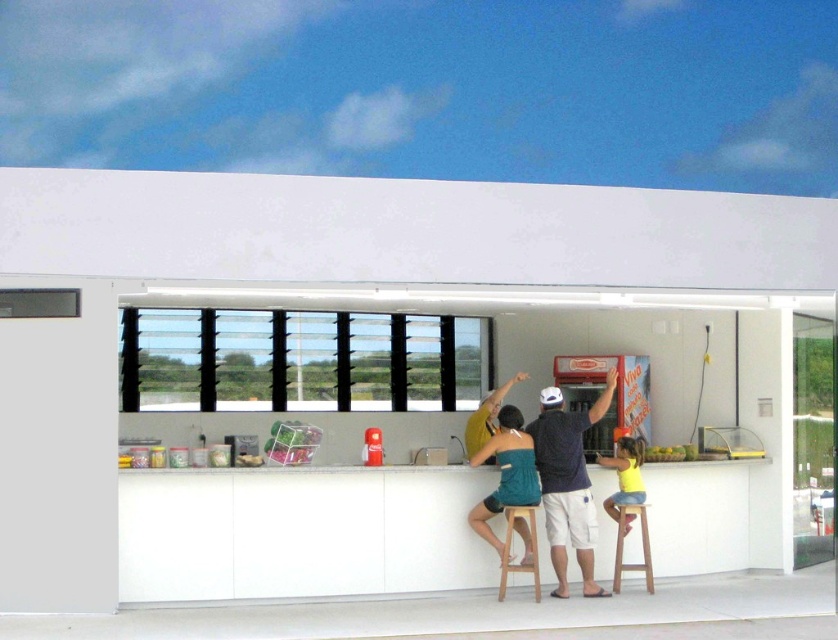
Describe the element at coordinates (505, 474) in the screenshot. I see `teal fabric dress at center` at that location.

Which is above, teal fabric dress at center or wooden stool at center?

teal fabric dress at center is higher up.

Is point (516, 483) in front of point (535, 506)?

Yes, point (516, 483) is in front of point (535, 506).

Locate an element on the screen. teal fabric dress at center is located at coordinates (505, 474).

Between yellow cotton shirt at center and wooden stool at center, which one is positioned lower?

wooden stool at center

Can you confirm if yellow cotton shirt at center is wider than wooden stool at center?

Yes.

Is point (622, 436) farther from viewer compared to point (530, 568)?

Yes, point (622, 436) is farther from viewer.

Find the location of a particular element. yellow cotton shirt at center is located at coordinates (624, 474).

Which is above, yellow cotton shirt at center or wooden stool at lower center?

Positioned higher is yellow cotton shirt at center.

Who is more distant from viewer, (613, 499) or (634, 570)?

Point (613, 499)

At what (x,y) coordinates should I click in order to perform the action: click on yellow cotton shirt at center. Please return your answer as a coordinate pair (x, y). Image resolution: width=838 pixels, height=640 pixels. Looking at the image, I should click on (624, 474).